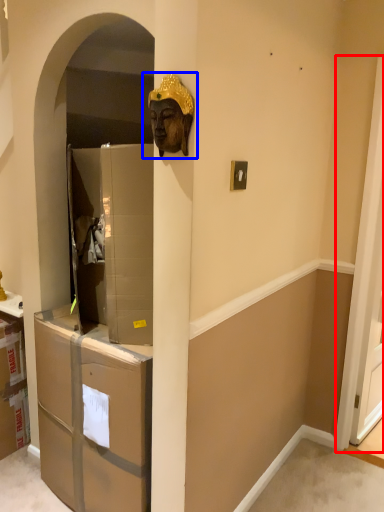
Question: Which point is closer to the camera, screen door (highlighted by a red box) or bronze statue (highlighted by a blue box)?

Choices:
 (A) screen door
 (B) bronze statue

Answer: (B)